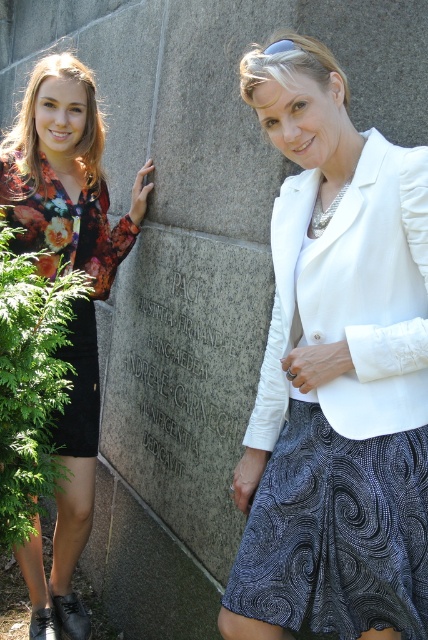
Based on the photo, you are a photographer trying to decide where to place a new subject between the white satin blazer at center and the floral print dress at left. Which clothing item is narrower so that the new subject can stand closer to it without blocking the view of the other?

The white satin blazer at center is thinner than the floral print dress at left, so the new subject can stand closer to the white satin blazer at center without blocking the view of the floral print dress at left.

You are a photographer trying to capture a closeup shot of the white satin blazer at center and the black granite stone at center. Since you want to focus on the details of both items, which one should you zoom in on more to ensure clarity?

The white satin blazer at center is smaller than the black granite stone at center, so you should zoom in more on the white satin blazer at center to ensure its details are clear.